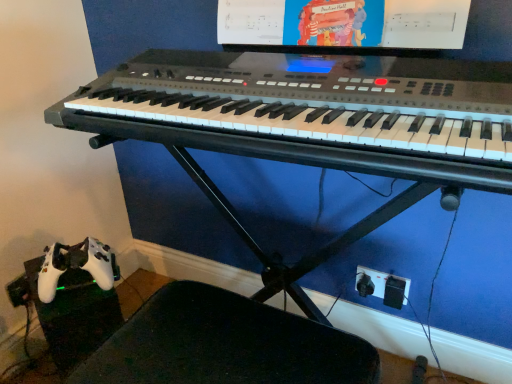
Question: From a real-world perspective, is satin black keyboard at center physically located above or below black plastic plug at lower right?

Choices:
 (A) below
 (B) above

Answer: (B)

Question: In the image, is satin black keyboard at center on the left side or the right side of black plastic plug at lower right?

Choices:
 (A) right
 (B) left

Answer: (B)

Question: Which object is the closest to the satin black keyboard at center?

Choices:
 (A) black plastic plug at lower right
 (B) matte plastic computer monitor at upper center
 (C) black plastic swivel chair at lower left

Answer: (B)

Question: Estimate the real-world distances between objects in this image. Which object is farther from the black plastic swivel chair at lower left?

Choices:
 (A) satin black keyboard at center
 (B) matte plastic computer monitor at upper center
 (C) black plastic plug at lower right

Answer: (B)